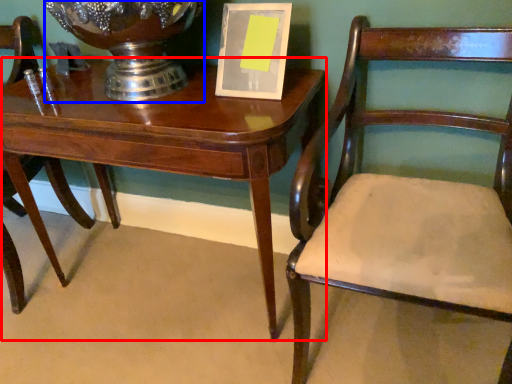
Question: Which point is further to the camera, table (highlighted by a red box) or glass vase (highlighted by a blue box)?

Choices:
 (A) table
 (B) glass vase

Answer: (A)